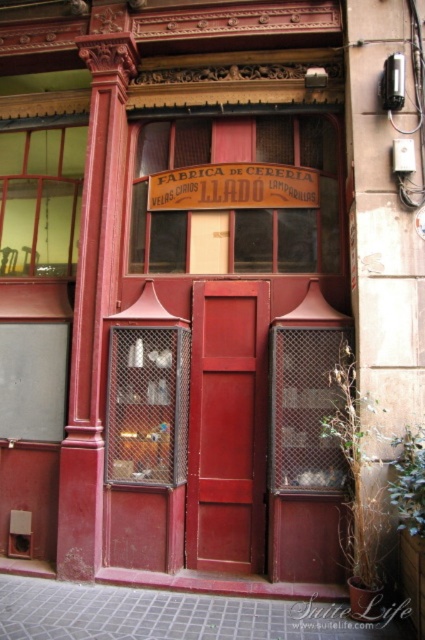
You are standing at the entrance of the building and need to locate the door. There is a sign above it. Which object is positioned to the left of the other between the matte wood door at center and the brown wood sign at center?

The matte wood door at center is to the left of the brown wood sign at center, so the door is positioned to the left of the sign.

You are a delivery person with a large package that is 1.2 meters wide. You need to enter the building through the entrance shown. Can your package fit through the matte wood door at center if the brown wood sign at center is 1.5 meters wide?

The matte wood door at center is narrower than the brown wood sign at center, which is 1.5 meters wide. Since the door is narrower than the sign, and your package is 1.2 meters wide, it depends on the door width. However, since the sign is wider, the door might still be wide enough. But according to the description, the door is less than the sign. If the door is less than 1.5 meters, then 1.2 could fit if the door is at least 1.2 meters. But since we donot know exact door width, but the sign is 1.5, and the

You are standing at the entrance of the building and need to locate the matte wood door at center. According to the coordinates provided, where exactly is the matte wood door positioned?

The matte wood door at center is positioned at point 0.667 on the x axis and 0.536 on the y axis.